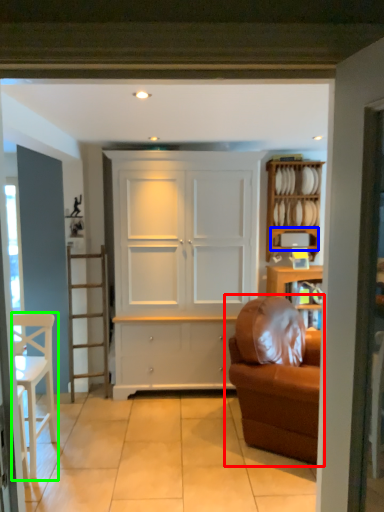
Question: Which object is positioned farthest from studio couch (highlighted by a red box)? Select from shelf (highlighted by a blue box) and chair (highlighted by a green box).

Choices:
 (A) shelf
 (B) chair

Answer: (B)